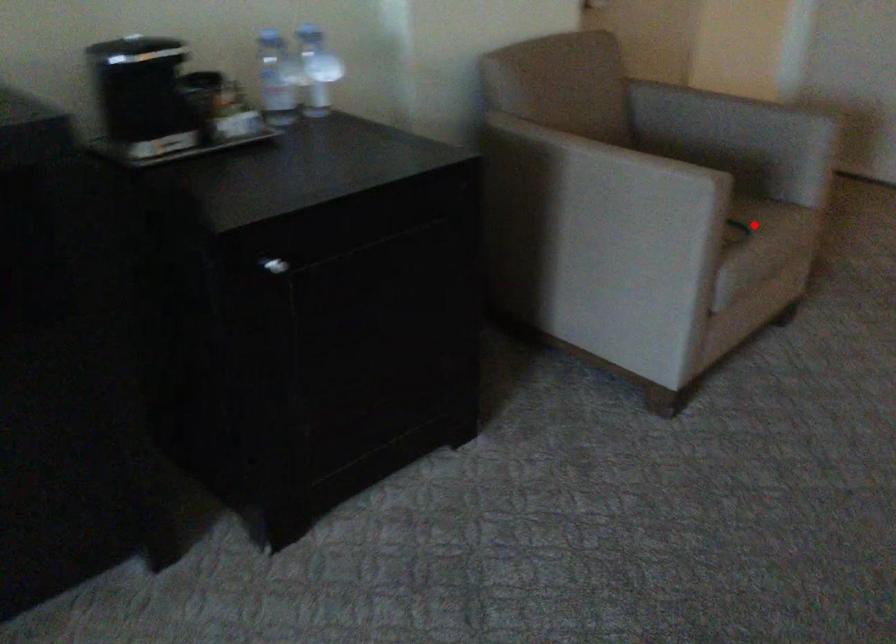
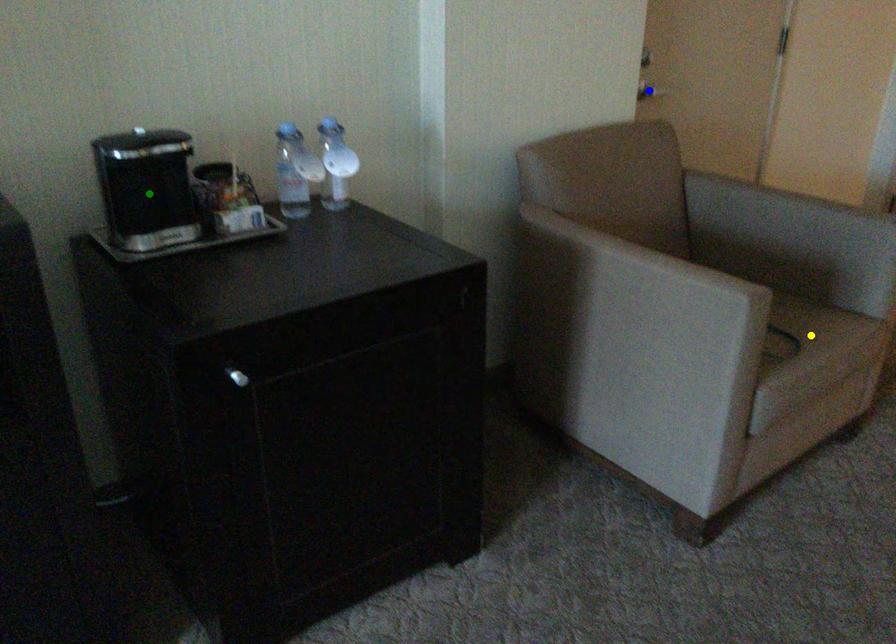
Question: I am providing you with two images of the same scene from different viewpoints. A red point is marked on the first image. You are given multiple points on the second image. Which spot in image 2 lines up with the point in image 1?

Choices:
 (A) yellow point
 (B) blue point
 (C) green point

Answer: (A)